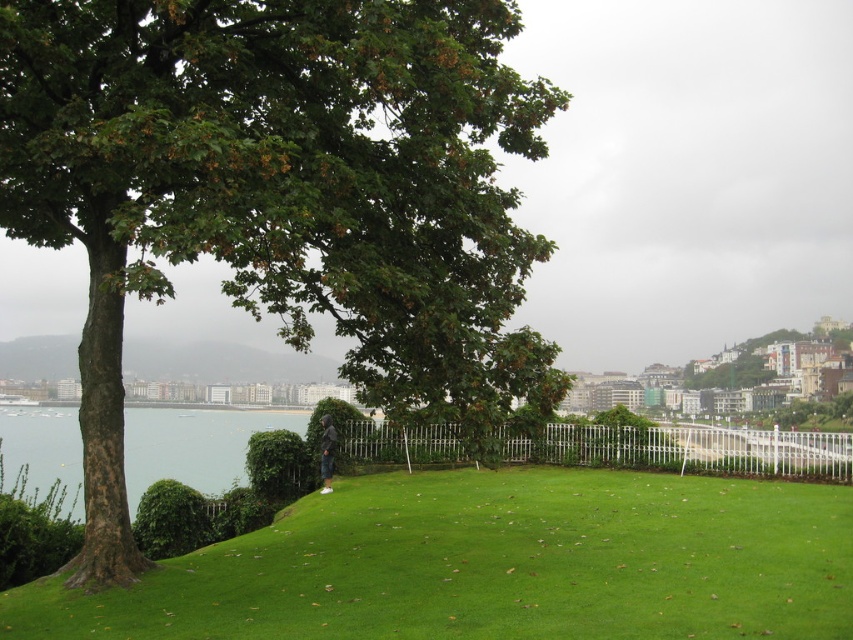
Consider the image. You are standing in the middle of the grassy area and want to walk towards the city view. Which direction should you go to avoid the green leafy tree at left and the white metal fence at center?

To avoid the green leafy tree at left and the white metal fence at center, you should walk towards the right side since the green leafy tree at left is to the left of the white metal fence at center, meaning the tree is on the left and the fence is in the center. Therefore, moving right would take you away from both obstacles towards the city view.

You are standing at the center of the grassy area and want to walk directly towards the green leafy tree at left. In which direction should you head?

Since the green leafy tree at left is located at coordinates [277,189], you should head towards the left direction to reach it.